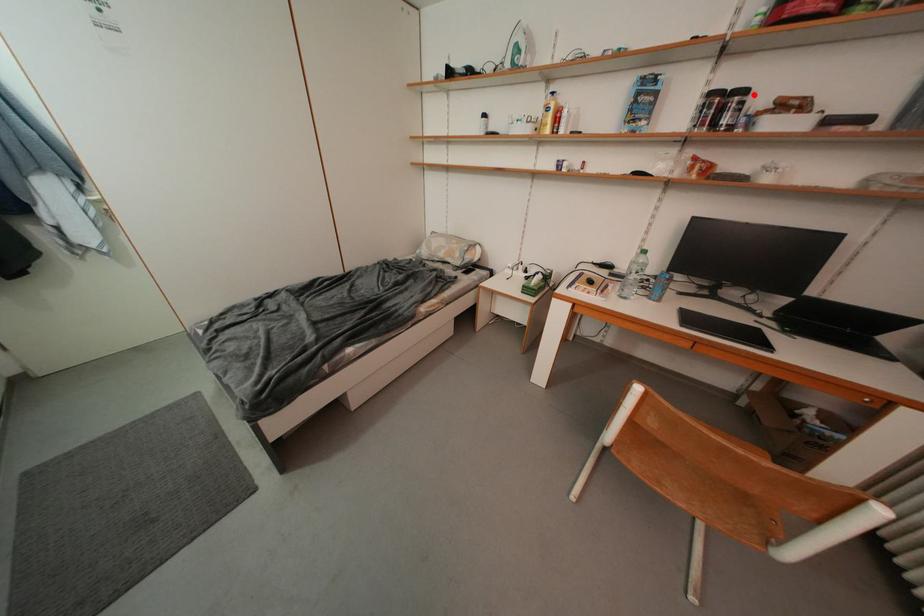
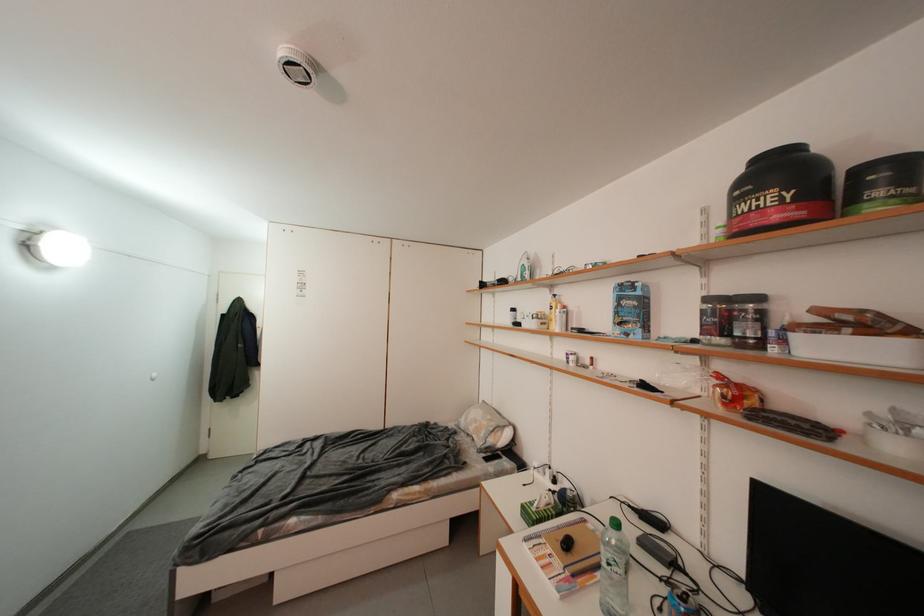
Where in the second image is the point corresponding to the highlighted location from the first image?

(766, 301)